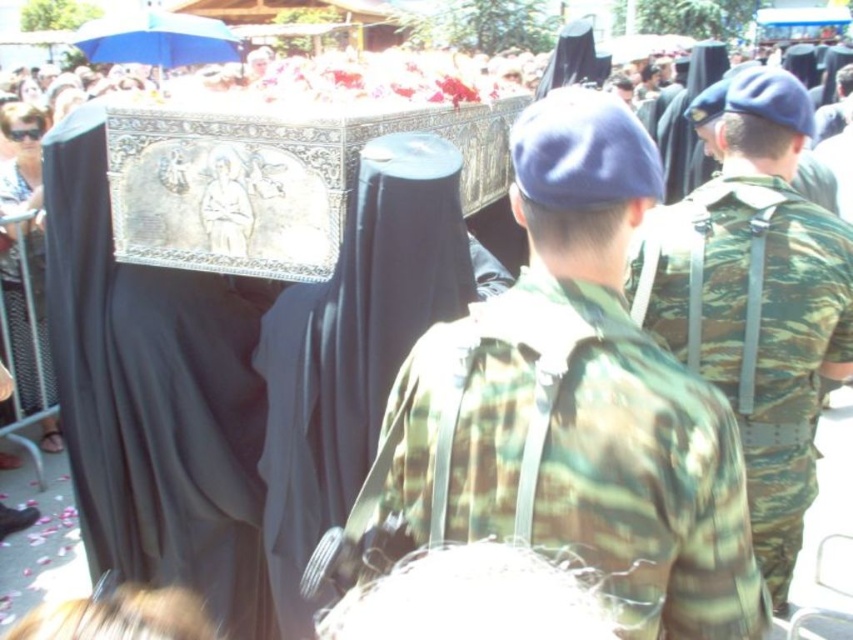
Which is more to the right, camouflage fabric backpack at center or camouflage fabric uniform at center?

From the viewer's perspective, camouflage fabric uniform at center appears more on the right side.

Measure the distance from camouflage fabric backpack at center to camouflage fabric uniform at center.

camouflage fabric backpack at center is 6.05 feet from camouflage fabric uniform at center.

Is point (621, 534) positioned before point (685, 355)?

Yes, point (621, 534) is in front of point (685, 355).

Locate an element on the screen. This screenshot has height=640, width=853. camouflage fabric backpack at center is located at coordinates (566, 410).